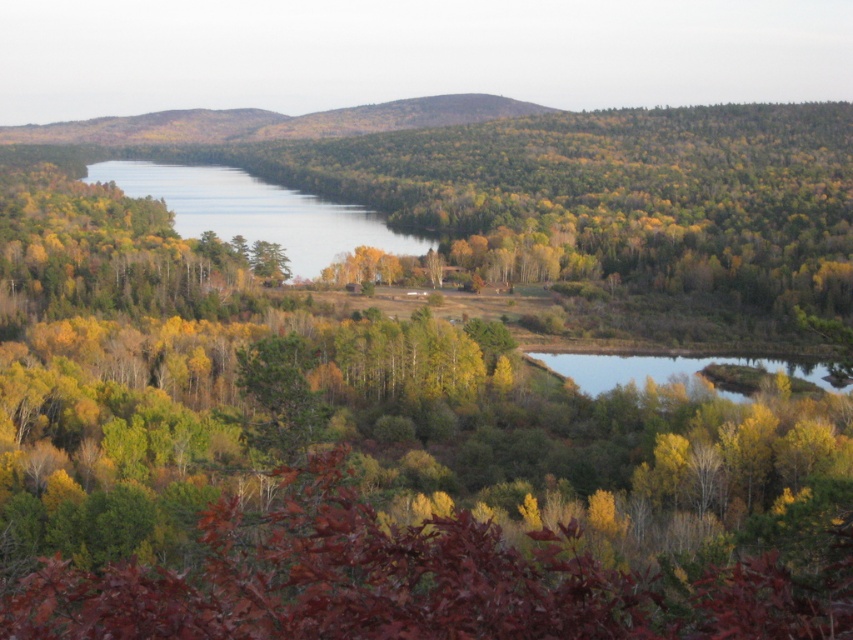
Question: Is clear water at center positioned before clear water at bottom right?

Choices:
 (A) yes
 (B) no

Answer: (B)

Question: From the image, what is the correct spatial relationship of clear water at center in relation to clear water at bottom right?

Choices:
 (A) below
 (B) above

Answer: (B)

Question: Which of the following is the farthest from the observer?

Choices:
 (A) (99, 168)
 (B) (749, 356)

Answer: (A)

Question: Which object appears farthest from the camera in this image?

Choices:
 (A) clear water at bottom right
 (B) clear water at center

Answer: (B)

Question: Is clear water at center thinner than clear water at bottom right?

Choices:
 (A) no
 (B) yes

Answer: (A)